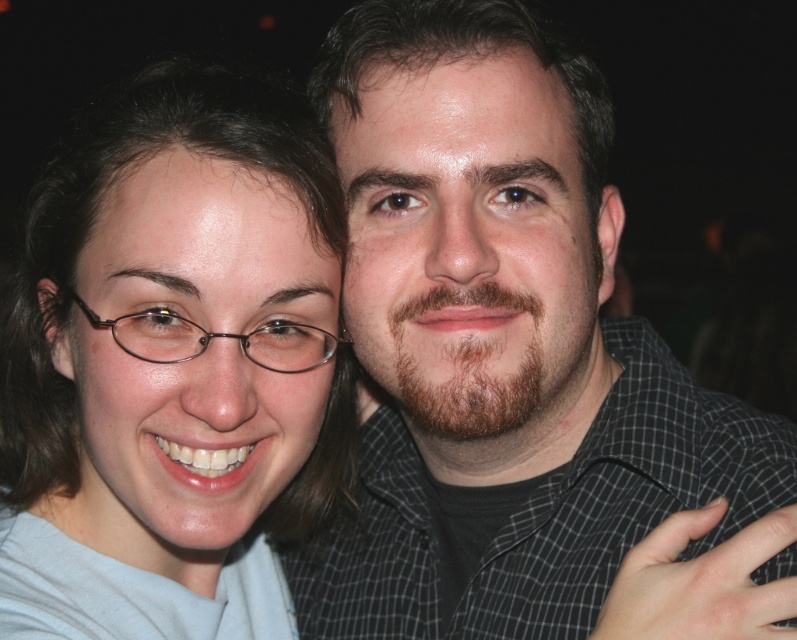
You are a photographer trying to adjust the lighting for a photo shoot. You notice two shirts in the image, the dark gray checkered shirt at center and the matte gray shirt at center. Which shirt would require more light adjustment if you want to ensure both shirts are equally visible?

The dark gray checkered shirt at center has a larger size compared to matte gray shirt at center, so it might require more light adjustment to ensure both shirts are equally visible.

You are a photographer trying to decide whether to crop the image to focus on one person. Given that the dark gray checkered shirt at center and the matte gray shirt at center are both in the center, which shirt might require more space to avoid being cut off?

The dark gray checkered shirt at center has a greater width than the matte gray shirt at center, so it would require more space to avoid being cut off.

You are a photographer standing 30 inches away from the dark gray checkered shirt at center. Can you get a clear photo of the shirt without moving closer?

The dark gray checkered shirt at center is 24.44 inches from viewer. Since you are 30 inches away, you are further than the shirt, so you can still take a clear photo without moving closer as the distance is sufficient.